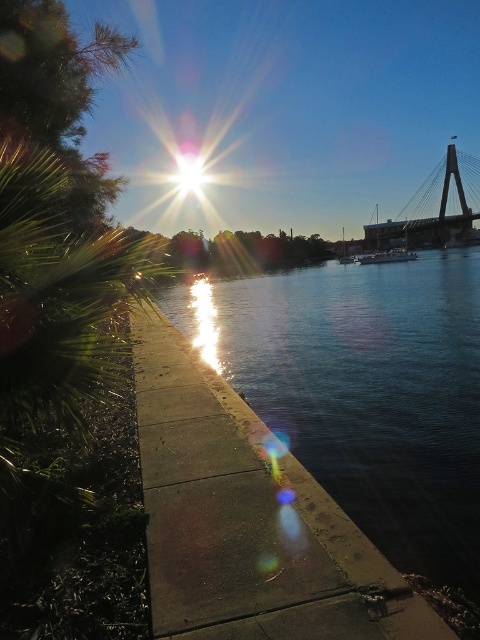
Question: Does concrete at center appear over metallic gray bridge at upper right?

Choices:
 (A) yes
 (B) no

Answer: (B)

Question: Is concrete at center closer to camera compared to metallic gray bridge at upper right?

Choices:
 (A) yes
 (B) no

Answer: (A)

Question: Which point is farther to the camera?

Choices:
 (A) (187, 435)
 (B) (447, 166)

Answer: (B)

Question: Does concrete at center appear on the right side of metallic gray bridge at upper right?

Choices:
 (A) no
 (B) yes

Answer: (A)

Question: Which point appears farthest from the camera in this image?

Choices:
 (A) (187, 486)
 (B) (402, 228)

Answer: (B)